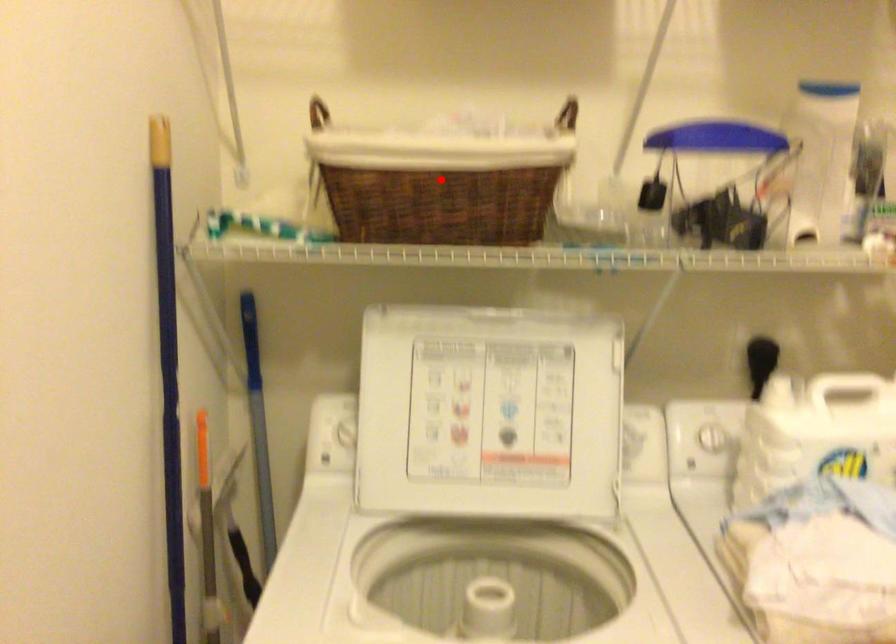
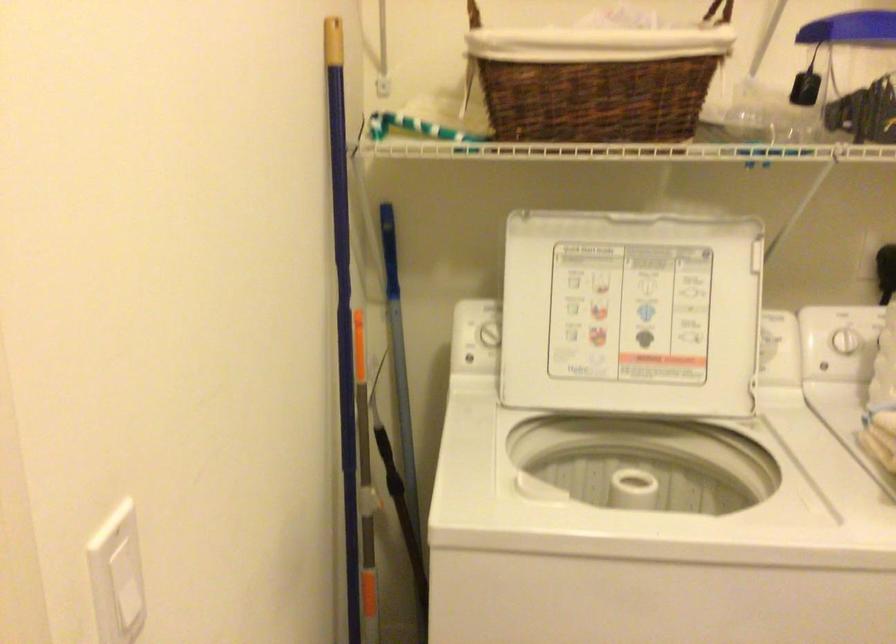
Locate, in the second image, the point that corresponds to the highlighted location in the first image.

(597, 79)